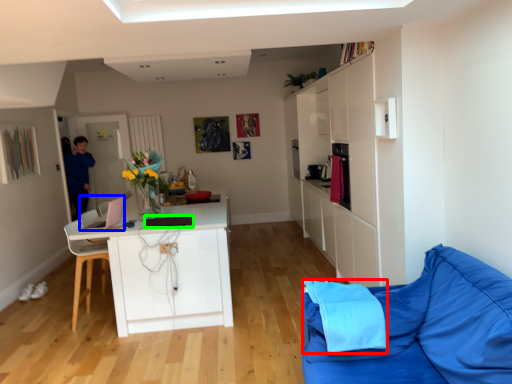
Question: Considering the real-world distances, which object is farthest from material (highlighted by a red box)? appliance (highlighted by a blue box) or appliance (highlighted by a green box)?

Choices:
 (A) appliance
 (B) appliance

Answer: (A)